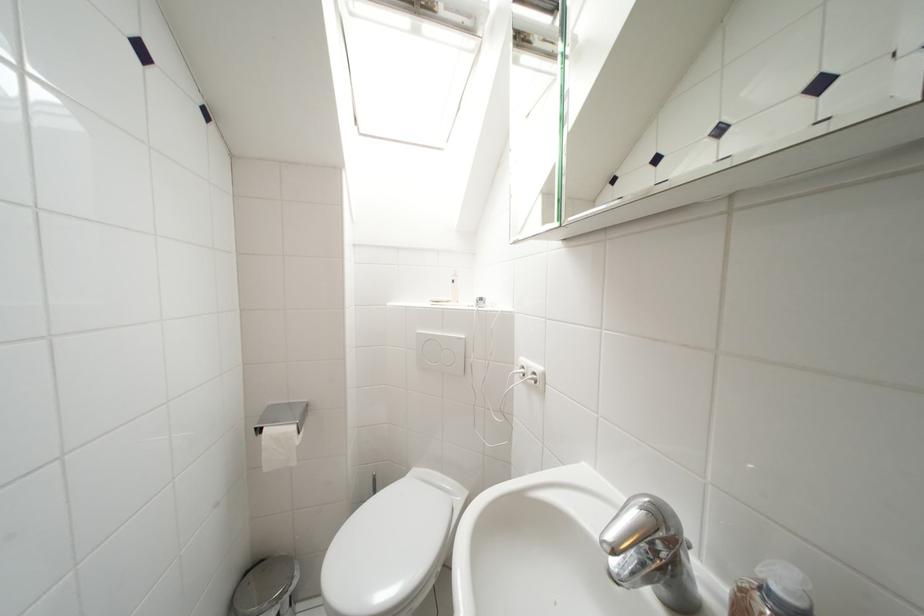
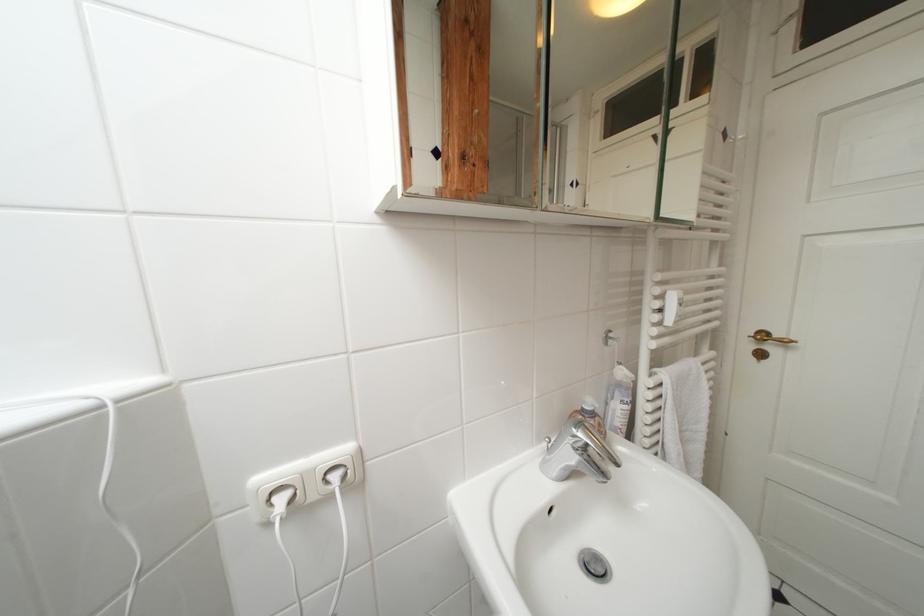
Question: The first image is from the beginning of the video and the second image is from the end. How did the camera likely rotate when shooting the video?

Choices:
 (A) Left
 (B) Right
 (C) Up
 (D) Down

Answer: (B)